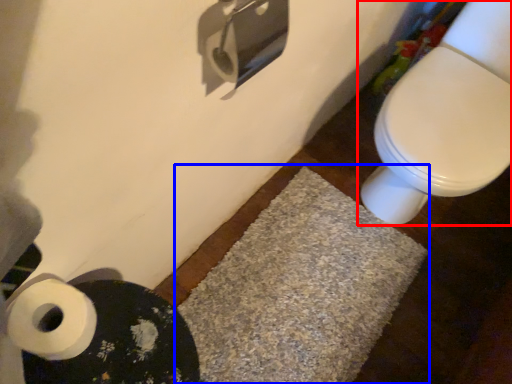
Question: Which object appears farthest to the camera in this image, toilet (highlighted by a red box) or bath mat (highlighted by a blue box)?

Choices:
 (A) toilet
 (B) bath mat

Answer: (B)